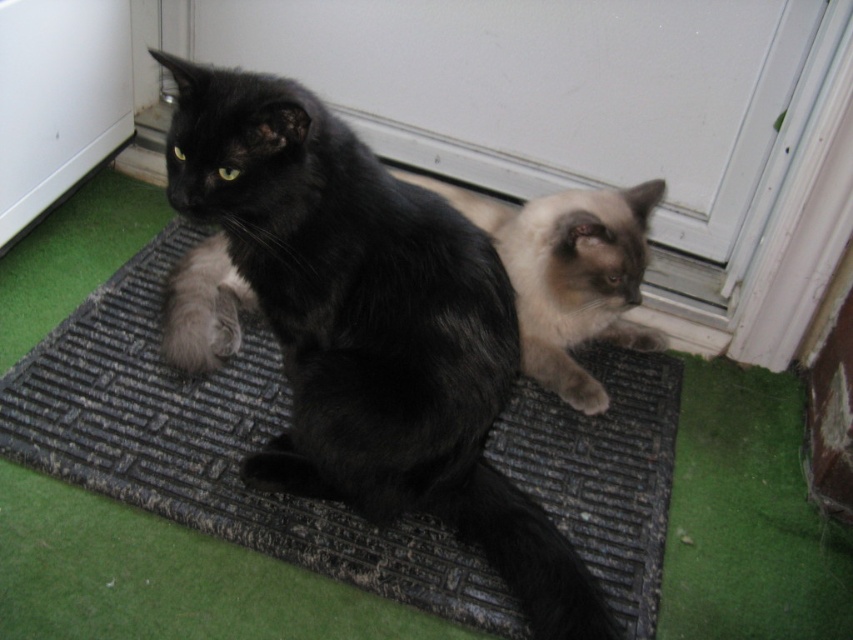
You are a photographer trying to capture both the matte black cat at center and the black fur cat at center in a single frame. Given that your camera has a fixed focus that can only clearly capture objects within a 30 cm width, can both cats fit in the frame without overlapping?

The matte black cat at center is wider than the black fur cat at center. However, without knowing their combined widths or the exact distance between them, it is impossible to determine if they can both fit within the 30 cm focus range. Additional measurements are required.

You are a photographer trying to capture both cats in a clear photo. Since the matte black cat at center and the black fur cat at center are positioned close to each other, which cat might be more visible in the photo?

The matte black cat at center is more visible because it is in front of the black fur cat at center, making it easier to see in the photo.